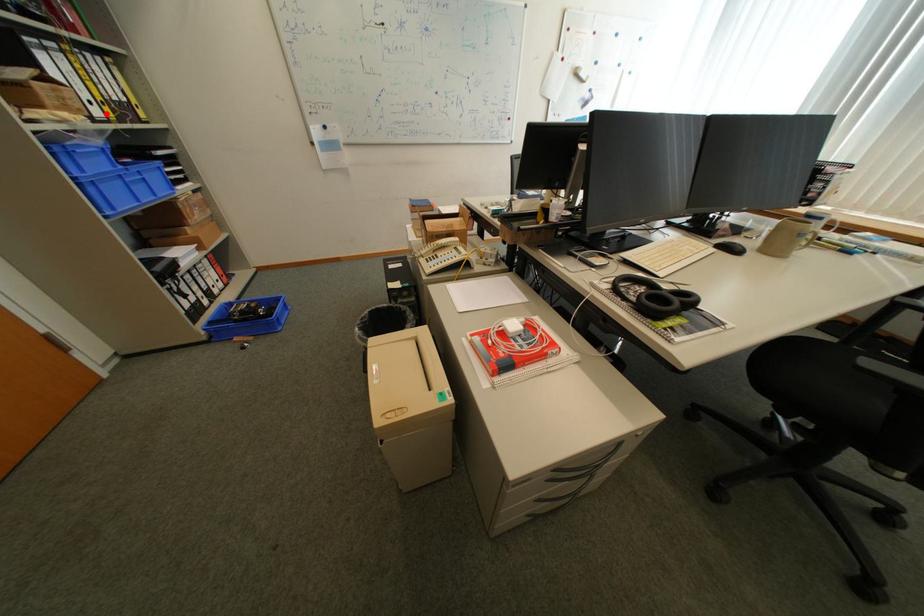
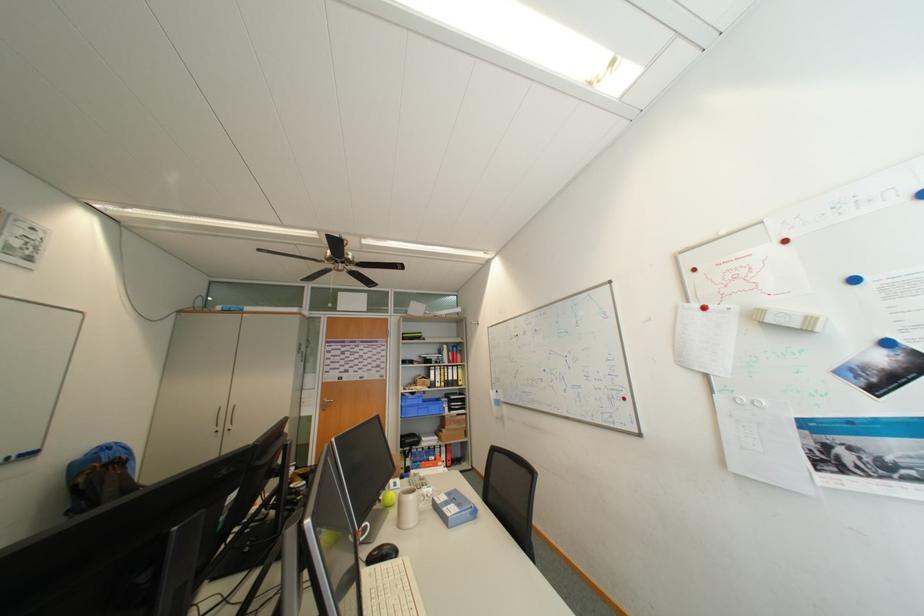
The point at the highlighted location is marked in the first image. Where is the corresponding point in the second image?

(447, 386)